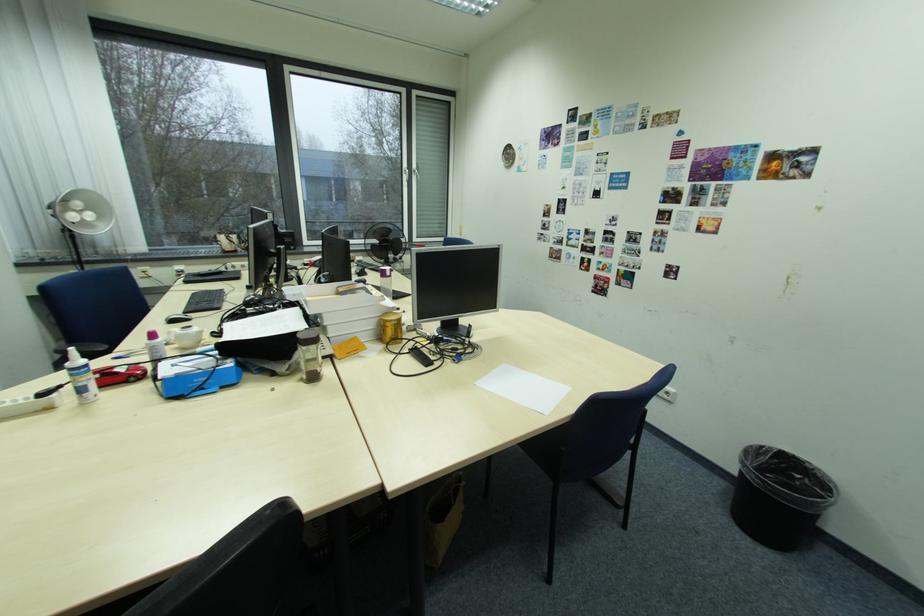
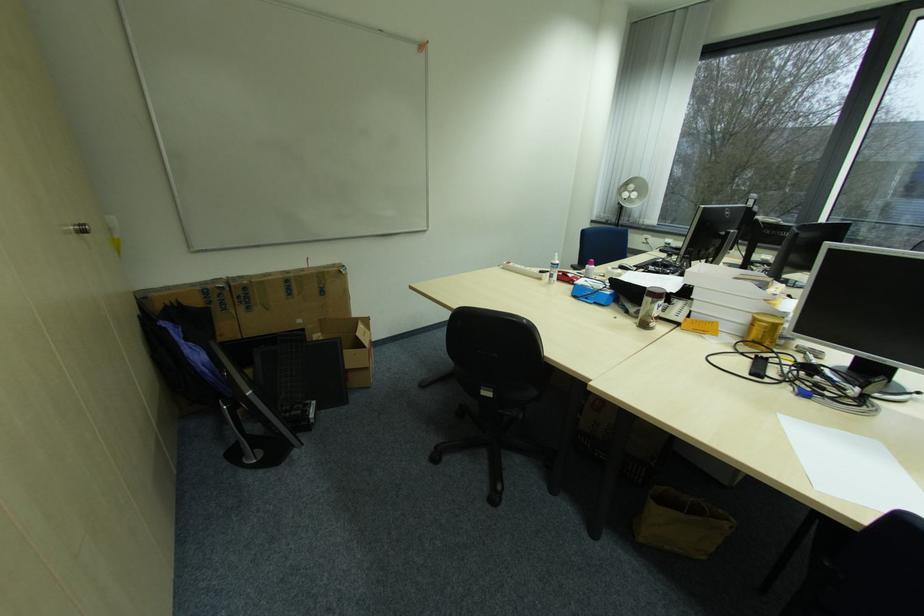
Locate, in the second image, the point that corresponds to point (160, 358) in the first image.

(592, 276)